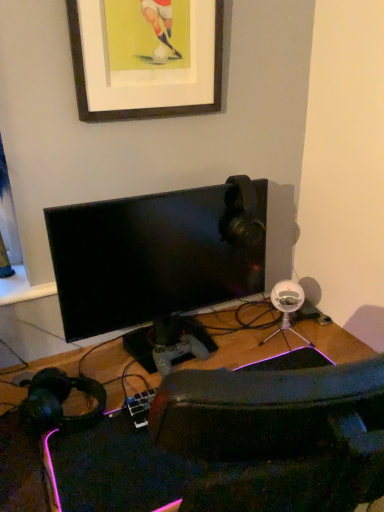
Where is `vacant point above wooden desk at center (from a real-world perspective)`? vacant point above wooden desk at center (from a real-world perspective) is located at coordinates (156, 384).